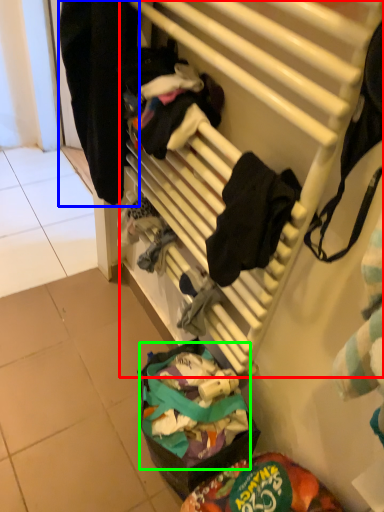
Question: Which is farther away from furniture (highlighted by a red box)? clothing (highlighted by a blue box) or food (highlighted by a green box)?

Choices:
 (A) clothing
 (B) food

Answer: (B)